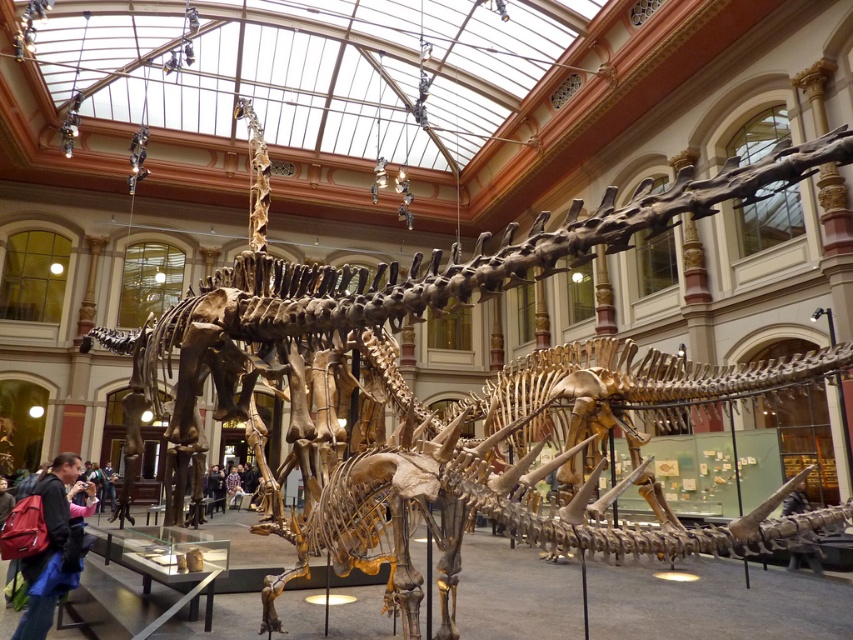
Measure the distance from smooth wooden stick at lower right to plaid shirt at center.

A distance of 16.22 meters exists between smooth wooden stick at lower right and plaid shirt at center.

Which is more to the right, smooth wooden stick at lower right or plaid shirt at center?

From the viewer's perspective, smooth wooden stick at lower right appears more on the right side.

Where is `smooth wooden stick at lower right`? This screenshot has width=853, height=640. smooth wooden stick at lower right is located at coordinates (804, 556).

Can you confirm if dark blue jacket at center is positioned below plaid shirt at center?

Incorrect, dark blue jacket at center is not positioned below plaid shirt at center.

Between dark blue jacket at center and plaid shirt at center, which one appears on the left side from the viewer's perspective?

From the viewer's perspective, dark blue jacket at center appears more on the left side.

Is point (207, 486) positioned before point (241, 467)?

Yes, it is in front of point (241, 467).

Where is `dark blue jacket at center`? dark blue jacket at center is located at coordinates (215, 488).

Based on the photo, which is below, smooth wooden stick at lower right or dark blue jacket at center?

dark blue jacket at center

Is smooth wooden stick at lower right bigger than dark blue jacket at center?

No.

Which is behind, point (793, 552) or point (224, 502)?

The point (224, 502) is behind.

Image resolution: width=853 pixels, height=640 pixels. I want to click on smooth wooden stick at lower right, so click(x=804, y=556).